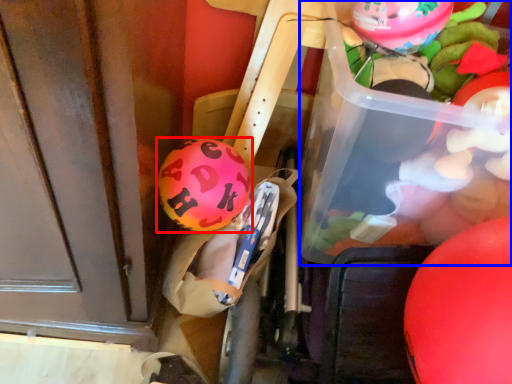
Question: Which object is further to the camera taking this photo, balloon (highlighted by a red box) or wide (highlighted by a blue box)?

Choices:
 (A) balloon
 (B) wide

Answer: (A)